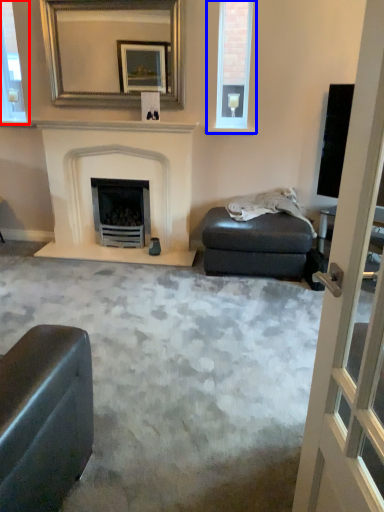
Question: Which point is closer to the camera, window frame (highlighted by a red box) or window (highlighted by a blue box)?

Choices:
 (A) window frame
 (B) window

Answer: (B)